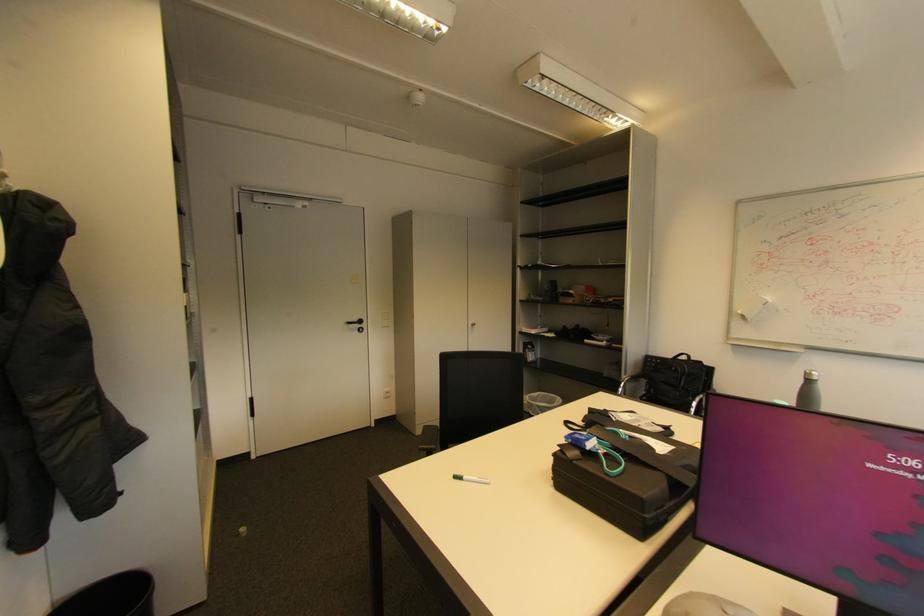
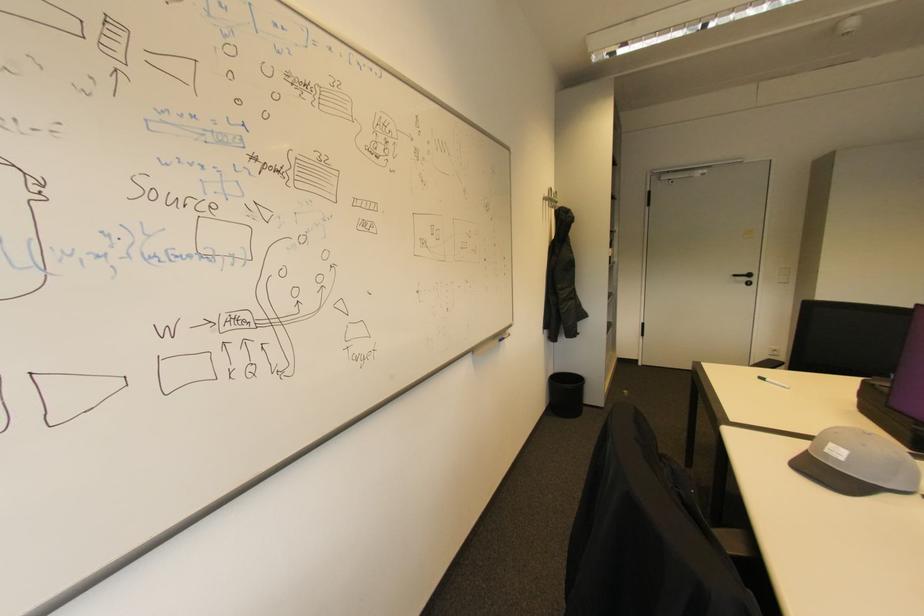
In the second image, find the point that corresponds to [366,322] in the first image.

(755, 276)